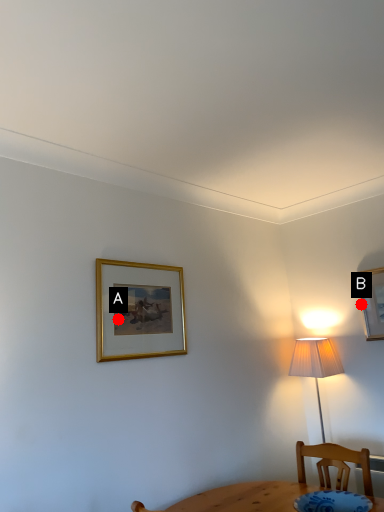
Question: Two points are circled on the image, labeled by A and B beside each circle. Which point is farther to the camera?

Choices:
 (A) A is further
 (B) B is further

Answer: (B)